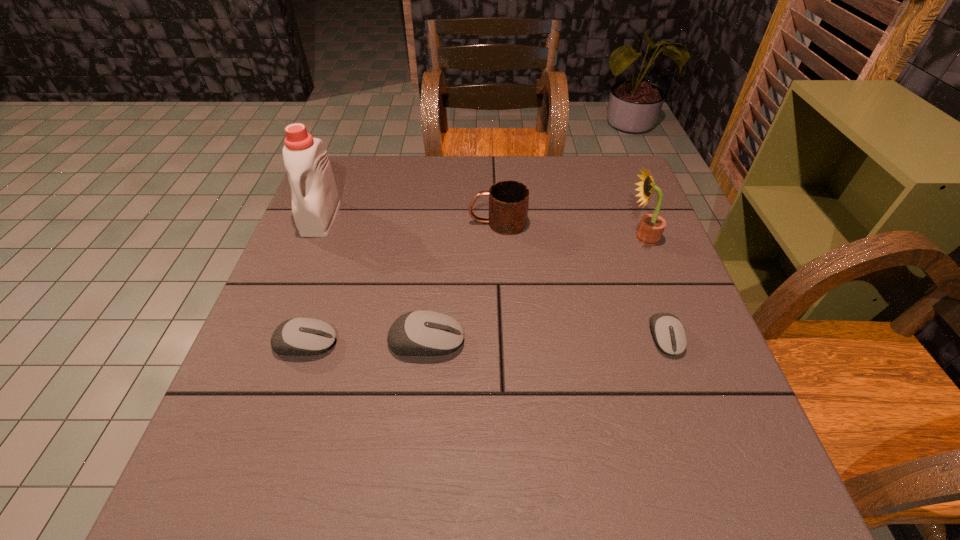
Please determine a free point for an extra mouse_(computer_equipment) to ensure balance. Please provide its 2D coordinates. Your answer should be formatted as a tuple, i.e. [(x, y)], where the tuple contains the x and y coordinates of a point satisfying the conditions above.

[(546, 340)]